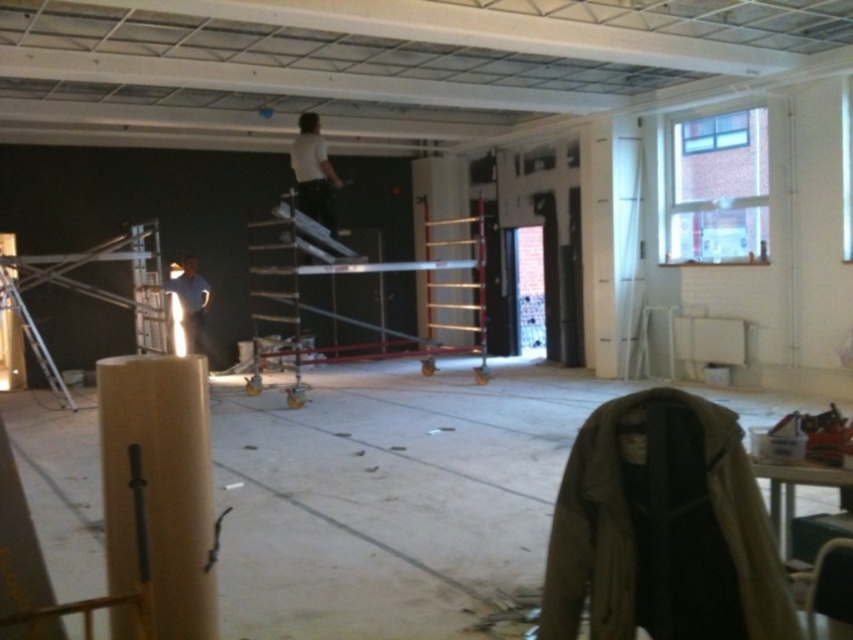
I want to click on wooden ladder at center, so click(x=456, y=289).

Describe the element at coordinates (456, 289) in the screenshot. Image resolution: width=853 pixels, height=640 pixels. I see `wooden ladder at center` at that location.

Find the location of a particular element. wooden ladder at center is located at coordinates (456, 289).

You are a GUI agent. You are given a task and a screenshot of the screen. Output one action in this format:
    pyautogui.click(x=<x>, y=<y>)
    Task: Click on the brown cardboard pillar at lower left
    
    Given the screenshot: What is the action you would take?
    pyautogui.click(x=160, y=486)

Is brown cardboard pillar at lower left positioned in front of wooden ladder at center?

Yes, brown cardboard pillar at lower left is closer to the viewer.

Image resolution: width=853 pixels, height=640 pixels. Identify the location of brown cardboard pillar at lower left. (160, 486).

Can you confirm if brown cardboard pillar at lower left is shorter than blue shirt at lower left?

Yes.

Does brown cardboard pillar at lower left have a larger size compared to blue shirt at lower left?

No.

Where is `brown cardboard pillar at lower left`? This screenshot has width=853, height=640. brown cardboard pillar at lower left is located at coordinates (160, 486).

Locate an element on the screen. This screenshot has width=853, height=640. brown cardboard pillar at lower left is located at coordinates (160, 486).